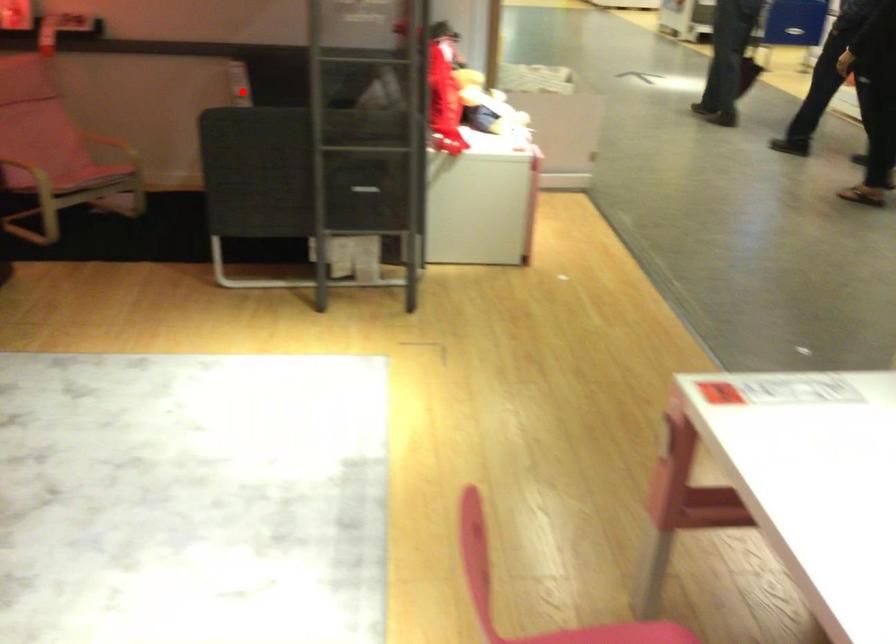
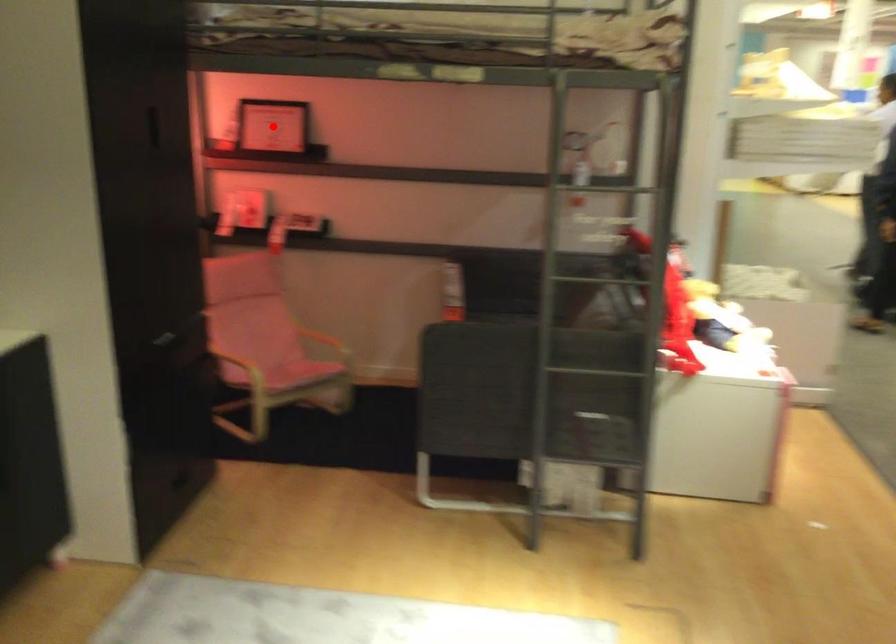
I am providing you with two images of the same scene from different viewpoints. A red point is marked on the first image and another point is marked on the second image. Is the red point in image1 aligned with the point shown in image2?

No